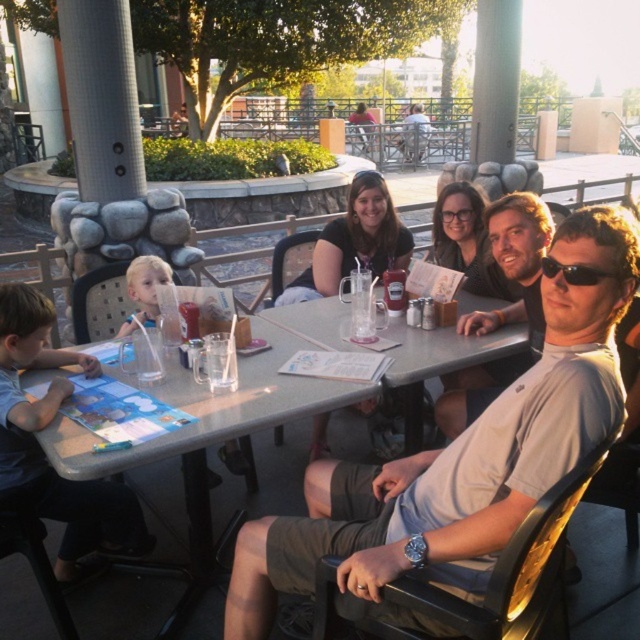
Between matte gray table at center and light brown shirt at center, which one appears on the left side from the viewer's perspective?

From the viewer's perspective, matte gray table at center appears more on the left side.

This screenshot has width=640, height=640. Describe the element at coordinates (218, 416) in the screenshot. I see `matte gray table at center` at that location.

Is point (419, 390) closer to viewer compared to point (508, 228)?

No.

Where is `matte gray table at center`? Image resolution: width=640 pixels, height=640 pixels. matte gray table at center is located at coordinates (218, 416).

Measure the distance between light gray t-shirt at center and matte gray table at center.

light gray t-shirt at center and matte gray table at center are 23.04 inches apart.

Who is more forward, (525, 476) or (438, 355)?

Point (525, 476) is more forward.

This screenshot has height=640, width=640. What do you see at coordinates (458, 460) in the screenshot?
I see `light gray t-shirt at center` at bounding box center [458, 460].

At what (x,y) coordinates should I click in order to perform the action: click on light gray t-shirt at center. Please return your answer as a coordinate pair (x, y). This screenshot has height=640, width=640. Looking at the image, I should click on (458, 460).

Between light gray t-shirt at center and light brown shirt at center, which one is positioned higher?

light brown shirt at center

Can you confirm if light gray t-shirt at center is taller than light brown shirt at center?

Yes, light gray t-shirt at center is taller than light brown shirt at center.

Who is more distant from viewer, (417, 502) or (496, 216)?

Positioned behind is point (496, 216).

The width and height of the screenshot is (640, 640). Identify the location of light gray t-shirt at center. (458, 460).